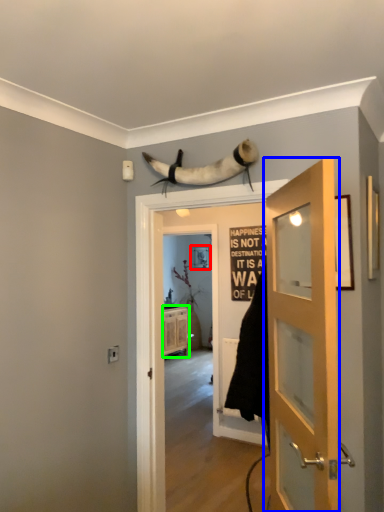
Question: Which object is positioned closest to picture frame (highlighted by a red box)? Select from door (highlighted by a blue box) and cabinetry (highlighted by a green box).

Choices:
 (A) door
 (B) cabinetry

Answer: (B)